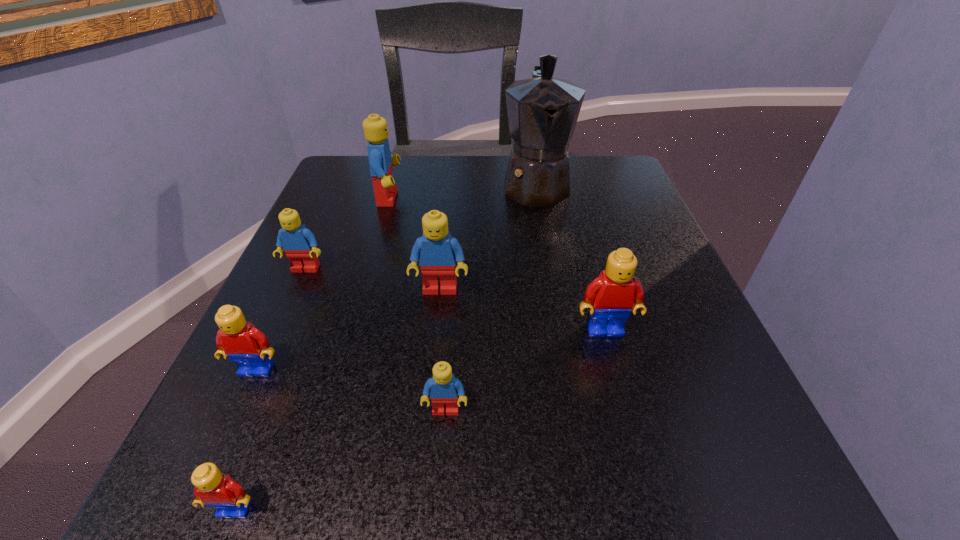
Locate an element on the screen. vacant space at the far edge is located at coordinates (410, 158).

Identify the location of vacant area at the near edge of the desktop. The height and width of the screenshot is (540, 960). (318, 505).

Where is `vacant space at the left edge of the desktop`? This screenshot has width=960, height=540. vacant space at the left edge of the desktop is located at coordinates (308, 274).

Locate an element on the screen. The image size is (960, 540). vacant space at the right edge is located at coordinates (730, 401).

At what (x,y) coordinates should I click in order to perform the action: click on free spot at the far right corner of the desktop. Please return your answer as a coordinate pair (x, y). The width and height of the screenshot is (960, 540). Looking at the image, I should click on (583, 171).

Image resolution: width=960 pixels, height=540 pixels. In the image, there is a desktop. What are the coordinates of `vacant space at the near right corner` in the screenshot? It's located at (681, 488).

Where is `free point between the second nearest yellow Lego and the third farthest object`? The width and height of the screenshot is (960, 540). free point between the second nearest yellow Lego and the third farthest object is located at coordinates (281, 319).

This screenshot has height=540, width=960. What are the coordinates of `free space between the fourth Lego from right to left and the second biggest yellow Lego` in the screenshot? It's located at (323, 284).

Identify the location of vacant area that lies between the second nearest blue Lego and the smallest blue Lego. (443, 350).

You are a GUI agent. You are given a task and a screenshot of the screen. Output one action in this format:
    pyautogui.click(x=<x>, y=<y>)
    Task: Click on the vacant area that lies between the nearest object and the third biggest blue Lego
    This screenshot has height=540, width=960.
    Given the screenshot: What is the action you would take?
    pyautogui.click(x=270, y=389)